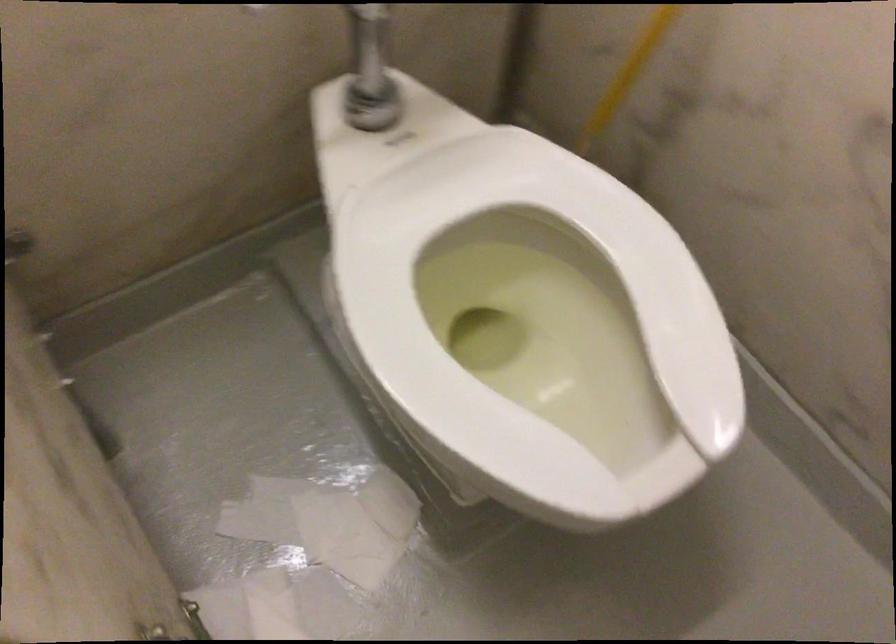
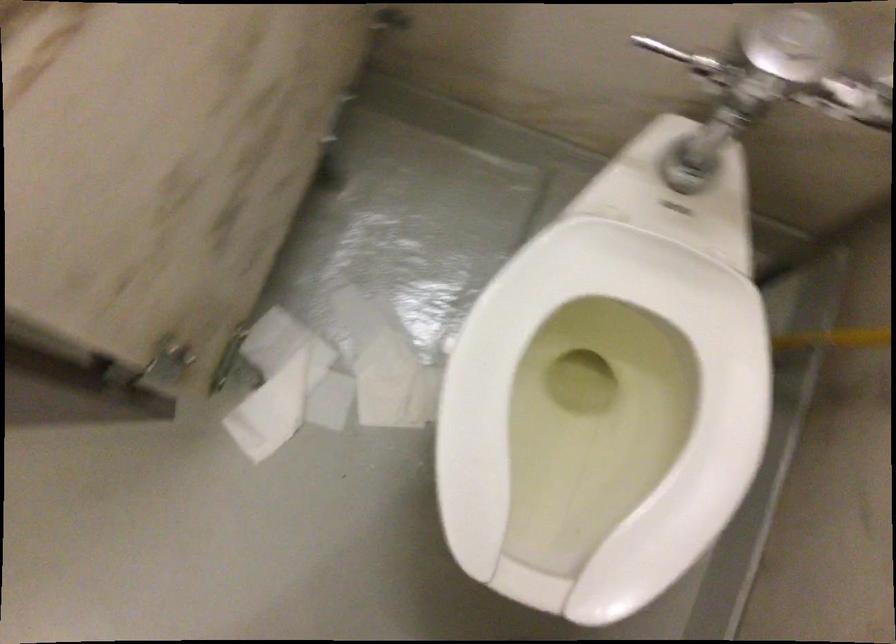
Find the pixel in the second image that matches [546,345] in the first image.

(600, 415)